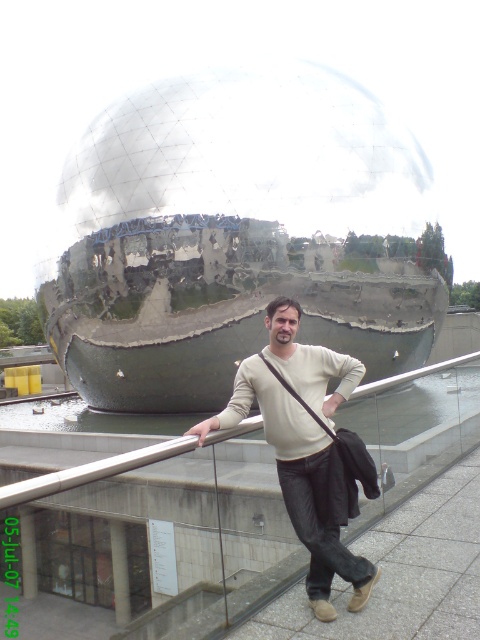
Question: Which of the following is the farthest from the observer?

Choices:
 (A) metal/smooth rail at center
 (B) metallic reflective sphere at center

Answer: (B)

Question: Where is metallic reflective sphere at center located in relation to light beige sweater at center in the image?

Choices:
 (A) above
 (B) below

Answer: (A)

Question: Does metallic reflective sphere at center appear under metal/smooth rail at center?

Choices:
 (A) yes
 (B) no

Answer: (B)

Question: Among these objects, which one is nearest to the camera?

Choices:
 (A) metallic reflective sphere at center
 (B) light beige sweater at center

Answer: (B)

Question: Does metallic reflective sphere at center have a lesser width compared to metal/smooth rail at center?

Choices:
 (A) yes
 (B) no

Answer: (B)

Question: Which object appears farthest from the camera in this image?

Choices:
 (A) metal/smooth rail at center
 (B) metallic reflective sphere at center

Answer: (B)